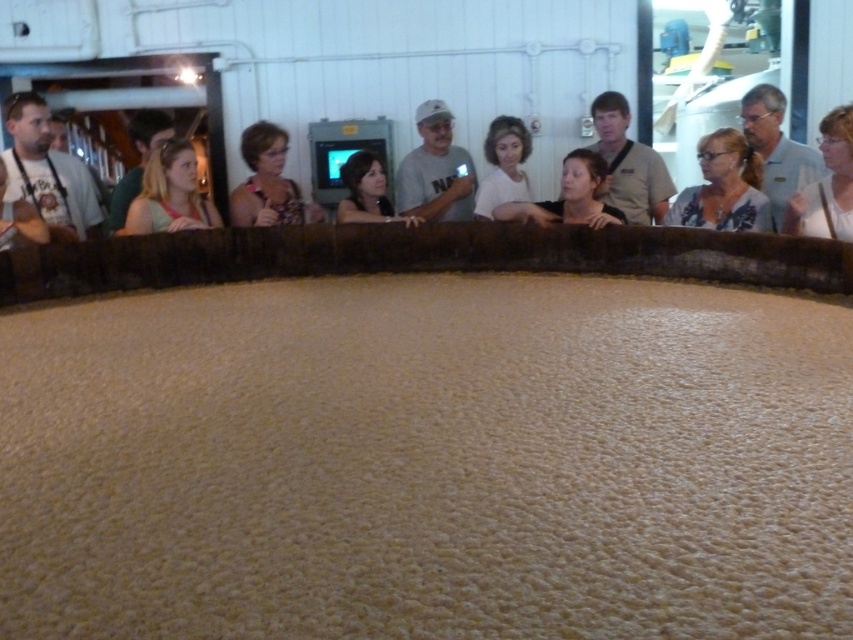
Question: Among these objects, which one is nearest to the camera?

Choices:
 (A) blonde hair at center
 (B) white matte shirt at upper right
 (C) white matte shirt at center

Answer: (B)

Question: Can you confirm if white floral blouse at upper center is thinner than white matte shirt at upper right?

Choices:
 (A) no
 (B) yes

Answer: (A)

Question: Which point is farther to the camera?

Choices:
 (A) (819, 177)
 (B) (149, 161)
 (C) (235, 195)

Answer: (C)

Question: Where is black fabric at center located in relation to smooth beige shirt at center in the image?

Choices:
 (A) below
 (B) above

Answer: (B)

Question: Does white floral blouse at upper center lie behind smooth beige shirt at center?

Choices:
 (A) yes
 (B) no

Answer: (B)

Question: Which object is closer to the camera taking this photo?

Choices:
 (A) blonde hair at center
 (B) gray fabric shirt at upper right
 (C) matte black shirt at center
 (D) white matte shirt at upper right

Answer: (D)